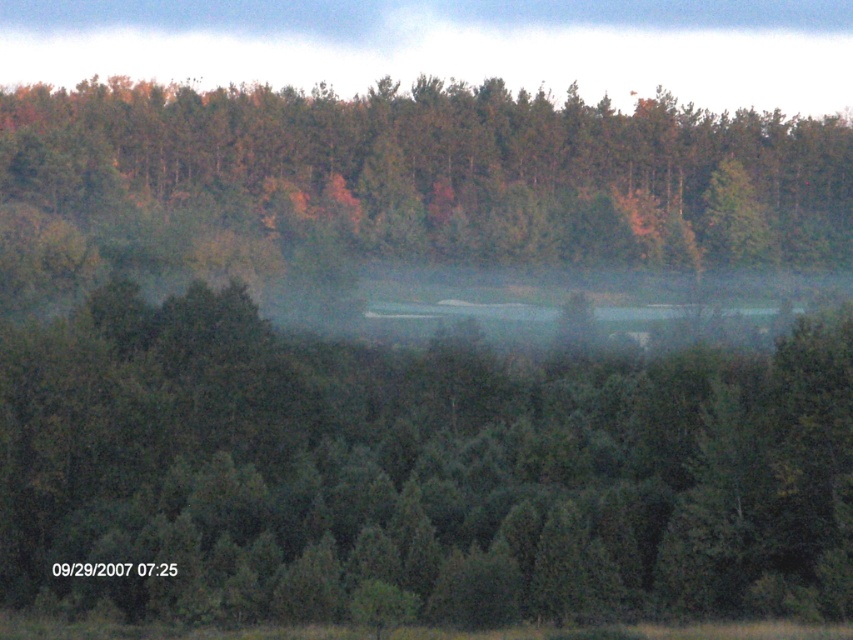
Which of these two, green matte tree at center or foggy mist at upper center, stands shorter?

With less height is green matte tree at center.

Who is more forward, (x=334, y=497) or (x=227, y=35)?

Point (x=334, y=497) is more forward.

Which is in front, point (129, 360) or point (543, 51)?

Point (129, 360) is in front.

Find the location of `green matte tree at center`. green matte tree at center is located at coordinates (415, 472).

Which is more to the left, green matte trees at upper center or foggy mist at upper center?

From the viewer's perspective, foggy mist at upper center appears more on the left side.

Who is taller, green matte trees at upper center or foggy mist at upper center?

Standing taller between the two is green matte trees at upper center.

The width and height of the screenshot is (853, 640). I want to click on green matte trees at upper center, so click(454, 168).

Is green matte tree at center further to camera compared to green matte trees at upper center?

No, it is not.

Which is in front, point (379, 536) or point (488, 88)?

Point (379, 536)

What do you see at coordinates (415, 472) in the screenshot? I see `green matte tree at center` at bounding box center [415, 472].

The height and width of the screenshot is (640, 853). I want to click on green matte tree at center, so click(415, 472).